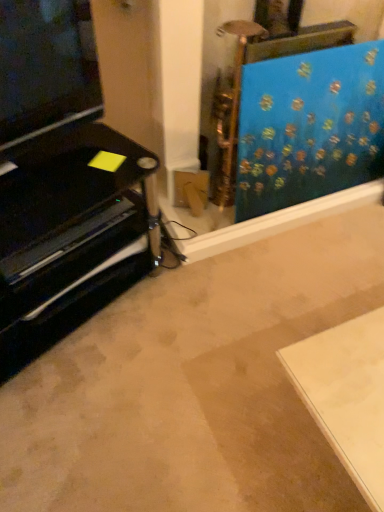
Question: In the image, is black glossy entertainment unit at left on the left side or the right side of blue fabric at upper right?

Choices:
 (A) right
 (B) left

Answer: (B)

Question: Considering the positions of black glossy entertainment unit at left and blue fabric at upper right in the image, is black glossy entertainment unit at left taller or shorter than blue fabric at upper right?

Choices:
 (A) tall
 (B) short

Answer: (B)

Question: Looking at their shapes, would you say black glossy entertainment unit at left is wider or thinner than blue fabric at upper right?

Choices:
 (A) thin
 (B) wide

Answer: (B)

Question: Which is correct: blue fabric at upper right is inside black glossy entertainment unit at left, or outside of it?

Choices:
 (A) inside
 (B) outside

Answer: (B)

Question: From the image's perspective, is blue fabric at upper right above or below black glossy entertainment unit at left?

Choices:
 (A) above
 (B) below

Answer: (A)

Question: Considering the positions of blue fabric at upper right and black glossy entertainment unit at left in the image, is blue fabric at upper right taller or shorter than black glossy entertainment unit at left?

Choices:
 (A) tall
 (B) short

Answer: (A)

Question: Is blue fabric at upper right in front of or behind black glossy entertainment unit at left in the image?

Choices:
 (A) behind
 (B) front

Answer: (A)